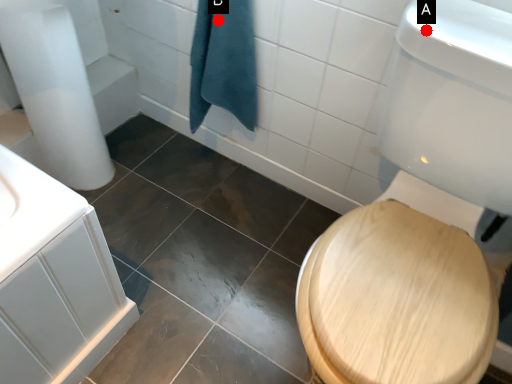
Question: Two points are circled on the image, labeled by A and B beside each circle. Which of the following is the farthest from the observer?

Choices:
 (A) A is further
 (B) B is further

Answer: (B)